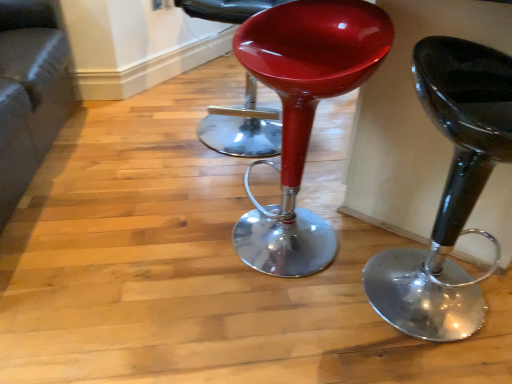
Question: Considering the relative sizes of velvet grey couch at lower left and glossy plastic stool at center, the 1th stool in the right-to-left sequence, in the image provided, is velvet grey couch at lower left wider than glossy plastic stool at center, the 1th stool in the right-to-left sequence,?

Choices:
 (A) no
 (B) yes

Answer: (B)

Question: From a real-world perspective, is velvet grey couch at lower left located beneath glossy plastic stool at center, the 2th stool in the left-to-right sequence?

Choices:
 (A) no
 (B) yes

Answer: (B)

Question: Is velvet grey couch at lower left to the right of glossy plastic stool at center, the 2th stool in the left-to-right sequence, from the viewer's perspective?

Choices:
 (A) yes
 (B) no

Answer: (B)

Question: Can you confirm if velvet grey couch at lower left is positioned to the left of glossy plastic stool at center, the 2th stool in the left-to-right sequence?

Choices:
 (A) no
 (B) yes

Answer: (B)

Question: Is velvet grey couch at lower left not close to glossy plastic stool at center, the 2th stool in the left-to-right sequence?

Choices:
 (A) yes
 (B) no

Answer: (A)

Question: Is velvet grey couch at lower left smaller than glossy plastic stool at center, the 1th stool in the right-to-left sequence?

Choices:
 (A) no
 (B) yes

Answer: (A)

Question: Is glossy plastic stool at center, the 2th stool when ordered from right to left, far from glossy plastic stool at center?

Choices:
 (A) yes
 (B) no

Answer: (B)

Question: Can you confirm if glossy plastic stool at center, the 2th stool when ordered from right to left, is wider than glossy plastic stool at center?

Choices:
 (A) yes
 (B) no

Answer: (B)

Question: Is glossy plastic stool at center, which is counted as the 1th stool, starting from the left, shorter than glossy plastic stool at center?

Choices:
 (A) no
 (B) yes

Answer: (A)

Question: Considering the relative positions of glossy plastic stool at center, which is counted as the 1th stool, starting from the left, and glossy plastic stool at center in the image provided, is glossy plastic stool at center, which is counted as the 1th stool, starting from the left, in front of glossy plastic stool at center?

Choices:
 (A) yes
 (B) no

Answer: (A)

Question: Is glossy plastic stool at center, the 2th stool when ordered from right to left, at the left side of glossy plastic stool at center?

Choices:
 (A) yes
 (B) no

Answer: (B)

Question: From the image's perspective, is glossy plastic stool at center, the 2th stool when ordered from right to left, under glossy plastic stool at center?

Choices:
 (A) no
 (B) yes

Answer: (B)

Question: Would you consider glossy plastic stool at center, which is counted as the 1th stool, starting from the left, to be distant from velvet grey couch at lower left?

Choices:
 (A) no
 (B) yes

Answer: (B)